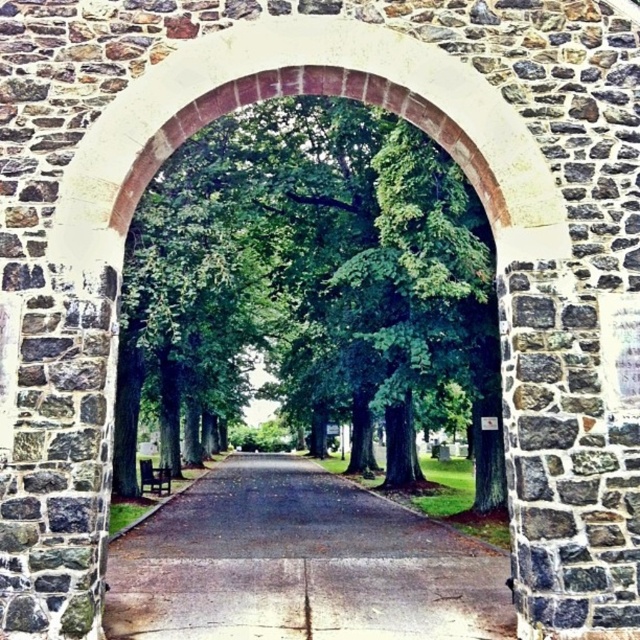
Based on the photo, can you confirm if green leafy tree at center is smaller than dark asphalt road at center?

No, green leafy tree at center is not smaller than dark asphalt road at center.

Based on the photo, is green leafy tree at center thinner than dark asphalt road at center?

No.

This screenshot has height=640, width=640. What are the coordinates of `green leafy tree at center` in the screenshot? It's located at (310, 276).